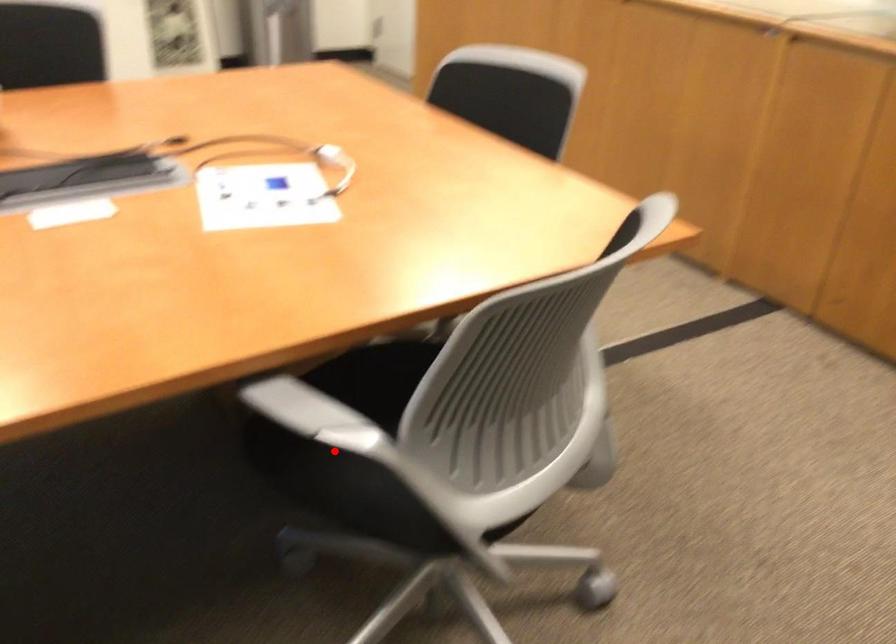
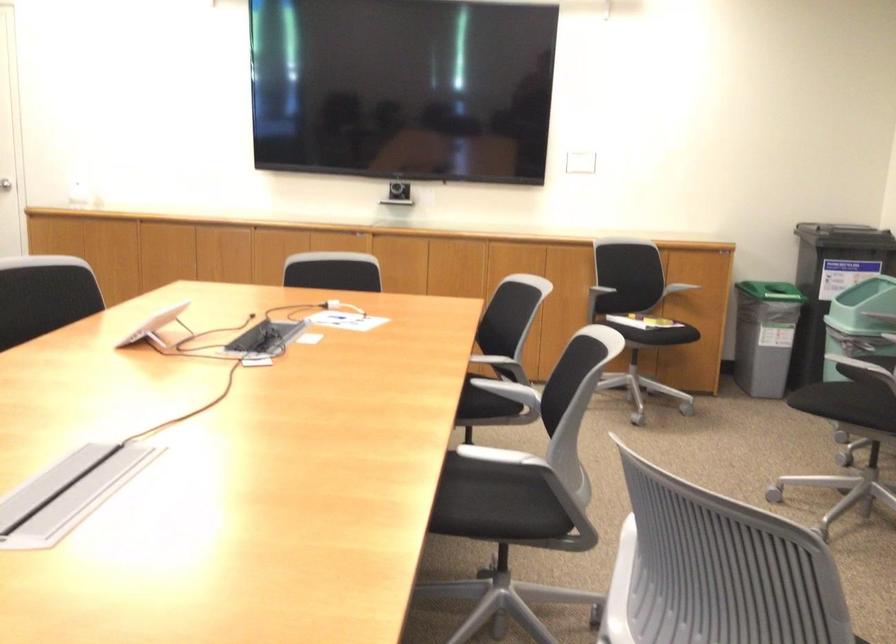
Question: I am providing you with two images of the same scene from different viewpoints. A red point is shown in image1. For the corresponding object point in image2, is it positioned nearer or farther from the camera?

Choices:
 (A) Nearer
 (B) Farther

Answer: (B)